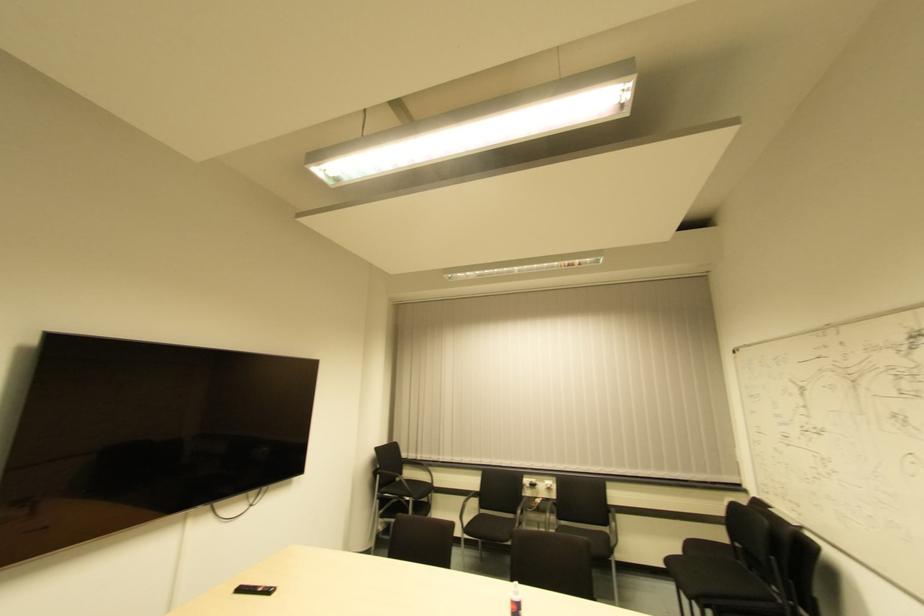
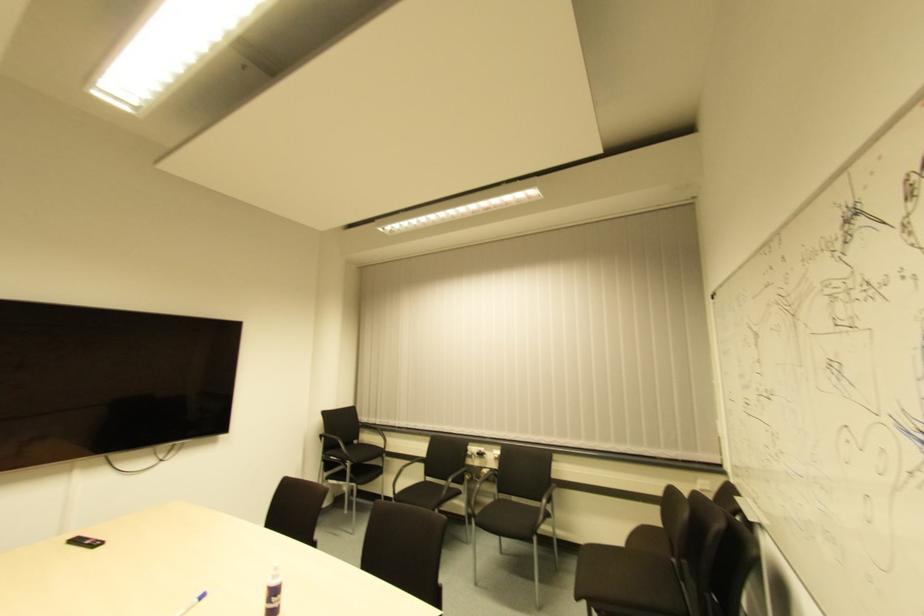
Find the pixel in the second image that matches (464,528) in the first image.

(395, 495)